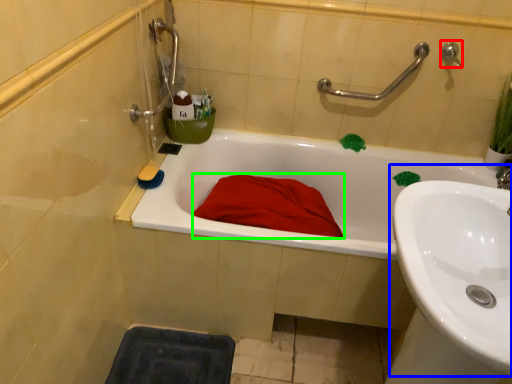
Question: Estimate the real-world distances between objects in this image. Which object is closer to plumbing fixture (highlighted by a red box), sink (highlighted by a blue box) or blanket (highlighted by a green box)?

Choices:
 (A) sink
 (B) blanket

Answer: (B)